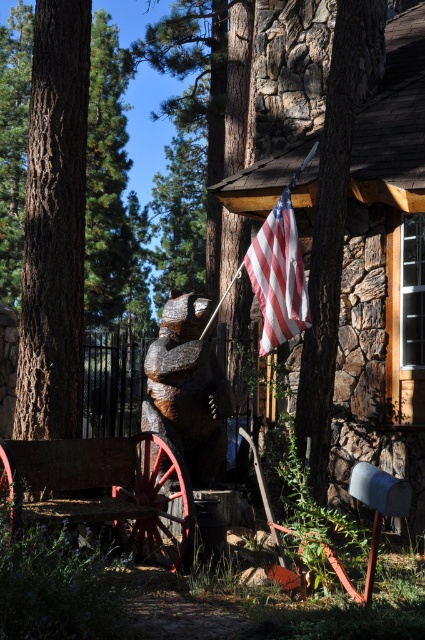
Question: Estimate the real-world distances between objects in this image. Which object is closer to the rustic wood wagon at center?

Choices:
 (A) american flag at upper center
 (B) wooden bear at center

Answer: (B)

Question: Can you confirm if rustic wood wagon at center is positioned above wooden bear at center?

Choices:
 (A) yes
 (B) no

Answer: (B)

Question: Does rustic wood wagon at center appear under wooden bear at center?

Choices:
 (A) no
 (B) yes

Answer: (B)

Question: Which of the following is the closest to the observer?

Choices:
 (A) american flag at upper center
 (B) rustic wood wagon at center
 (C) stone cabin at upper right
 (D) wooden bear at center

Answer: (B)

Question: Which point appears closest to the camera in this image?

Choices:
 (A) (215, 444)
 (B) (294, 205)
 (C) (260, 348)

Answer: (A)

Question: In this image, where is wooden bear at center located relative to american flag at upper center?

Choices:
 (A) right
 (B) left

Answer: (B)